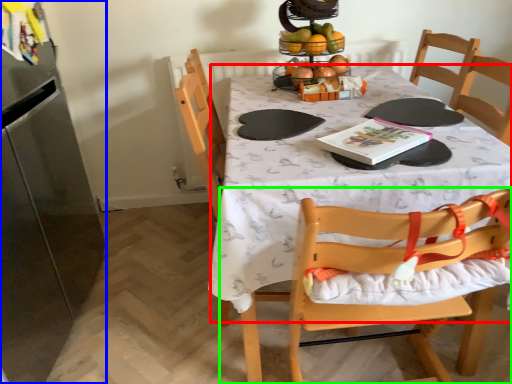
Question: Which object is the closest to the tablecloth (highlighted by a red box)? Choose among these: appliance (highlighted by a blue box) or chair (highlighted by a green box).

Choices:
 (A) appliance
 (B) chair

Answer: (B)